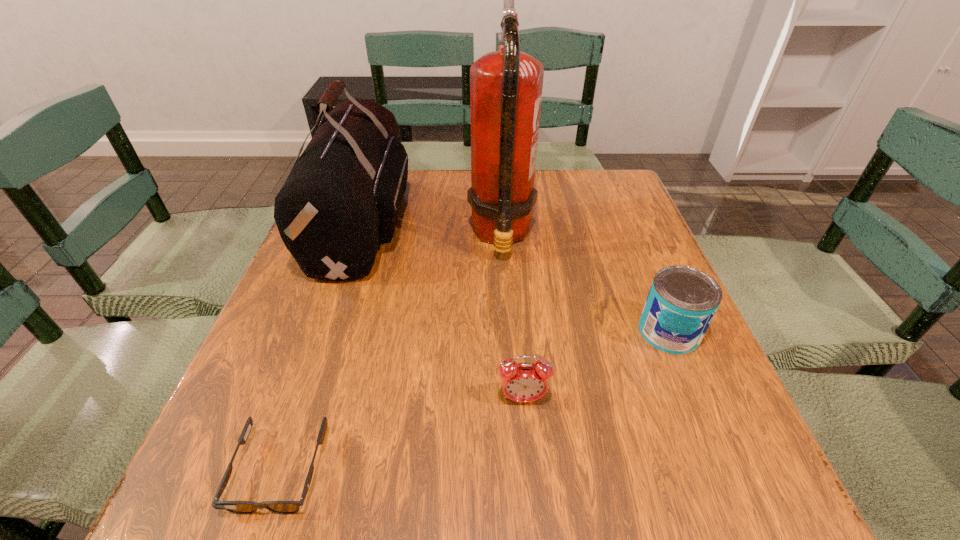
Image resolution: width=960 pixels, height=540 pixels. What are the coordinates of `vacant region located 0.050m on the front pocket of the fourth shortest object` in the screenshot? It's located at (427, 222).

Where is `free spot located on the left of the can`? free spot located on the left of the can is located at coordinates (516, 332).

Identify the location of free space located on the face of the alarm clock. This screenshot has width=960, height=540. (531, 501).

This screenshot has width=960, height=540. What are the coordinates of `fire extinguisher that is at the far edge` in the screenshot? It's located at (506, 86).

In order to click on duffel bag that is at the far edge in this screenshot , I will do `click(341, 200)`.

Find the location of `object that is at the near edge`. object that is at the near edge is located at coordinates (237, 507).

Image resolution: width=960 pixels, height=540 pixels. In order to click on duffel bag at the left edge in this screenshot , I will do `click(341, 200)`.

The image size is (960, 540). Identify the location of sunglasses located in the left edge section of the desktop. tap(237, 507).

Locate an element on the screen. The width and height of the screenshot is (960, 540). object positioned at the right edge is located at coordinates (682, 301).

This screenshot has height=540, width=960. Find the location of `object situated at the far left corner`. object situated at the far left corner is located at coordinates (341, 200).